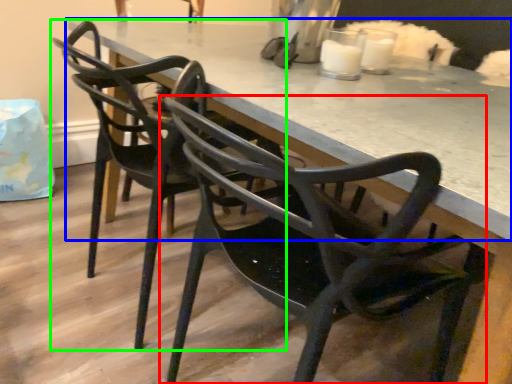
Question: Which is nearer to the chair (highlighted by a red box)? table (highlighted by a blue box) or chair (highlighted by a green box).

Choices:
 (A) table
 (B) chair

Answer: (A)